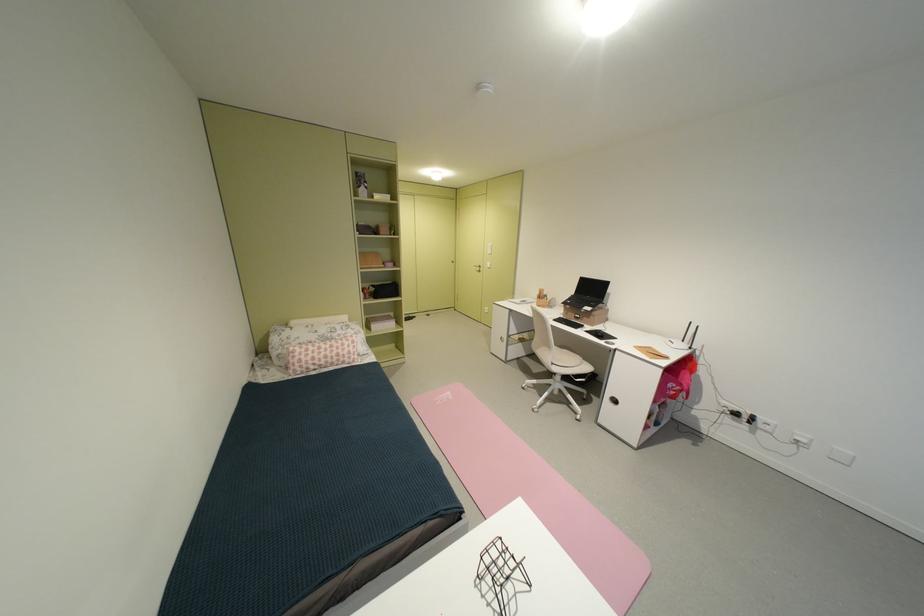
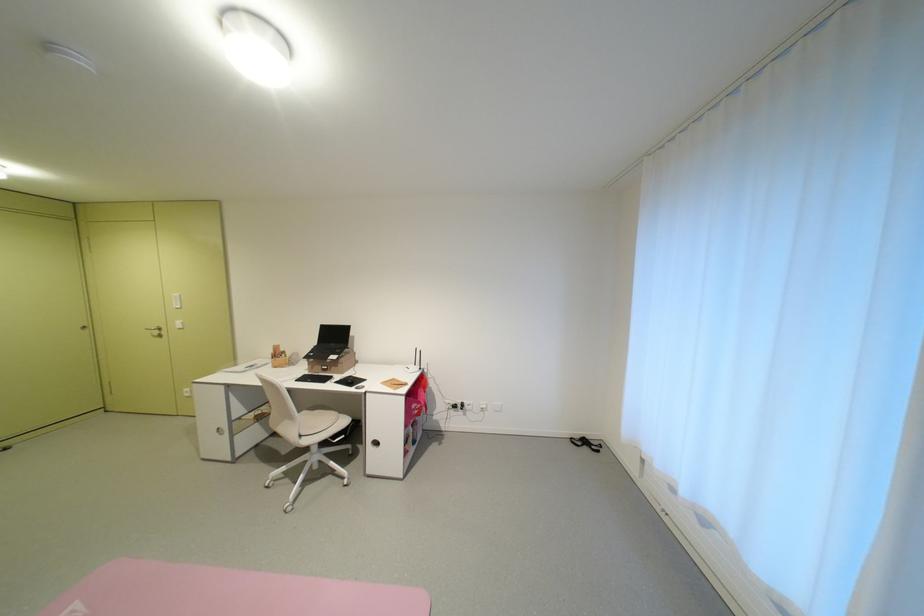
Find the pixel in the second image that matches (582,294) in the first image.

(324, 345)